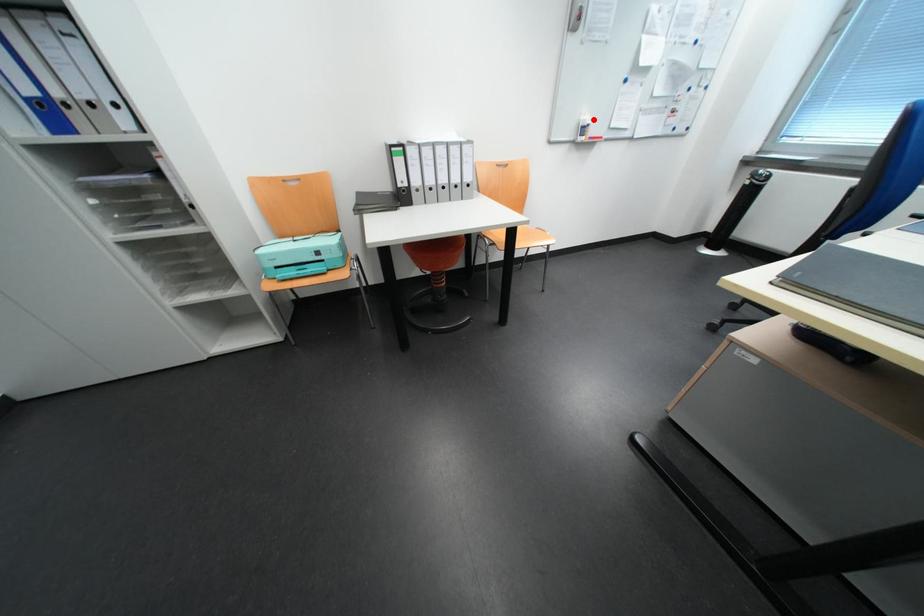
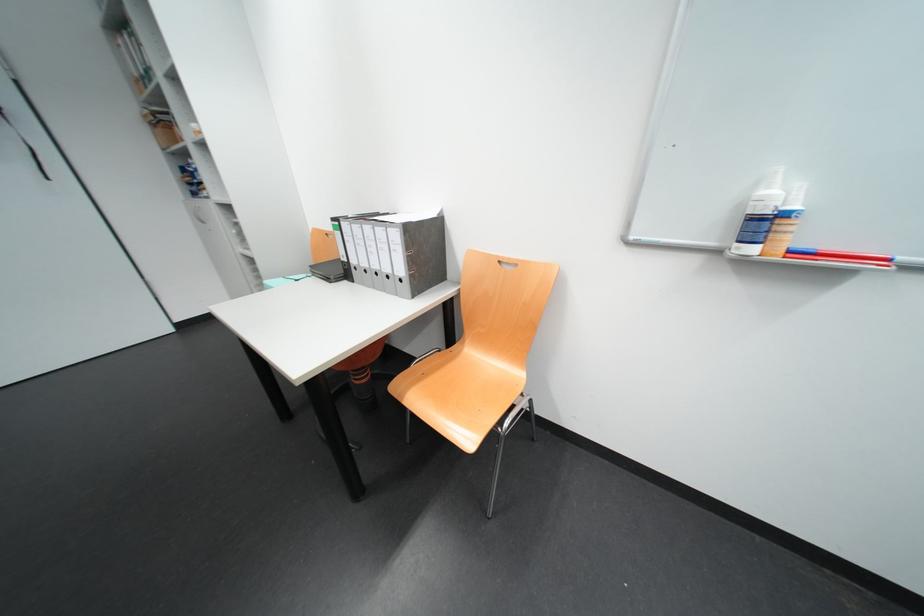
In the second image, find the point that corresponds to the highlighted location in the first image.

(773, 193)